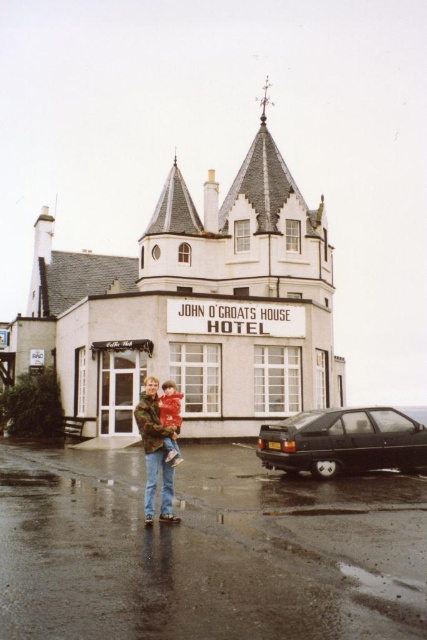
Question: Which of these objects is positioned farthest from the camouflage-patterned jacket at center?

Choices:
 (A) black matte car at lower right
 (B) camouflage jacket at center

Answer: (A)

Question: Is black matte car at lower right above camouflage-patterned jacket at center?

Choices:
 (A) no
 (B) yes

Answer: (A)

Question: Can you confirm if camouflage jacket at center is smaller than camouflage-patterned jacket at center?

Choices:
 (A) yes
 (B) no

Answer: (B)

Question: Which object is the farthest from the camouflage-patterned jacket at center?

Choices:
 (A) black matte car at lower right
 (B) camouflage jacket at center

Answer: (A)

Question: Is camouflage jacket at center in front of camouflage-patterned jacket at center?

Choices:
 (A) no
 (B) yes

Answer: (B)

Question: Which of the following is the farthest from the observer?

Choices:
 (A) (386, 445)
 (B) (166, 422)

Answer: (A)